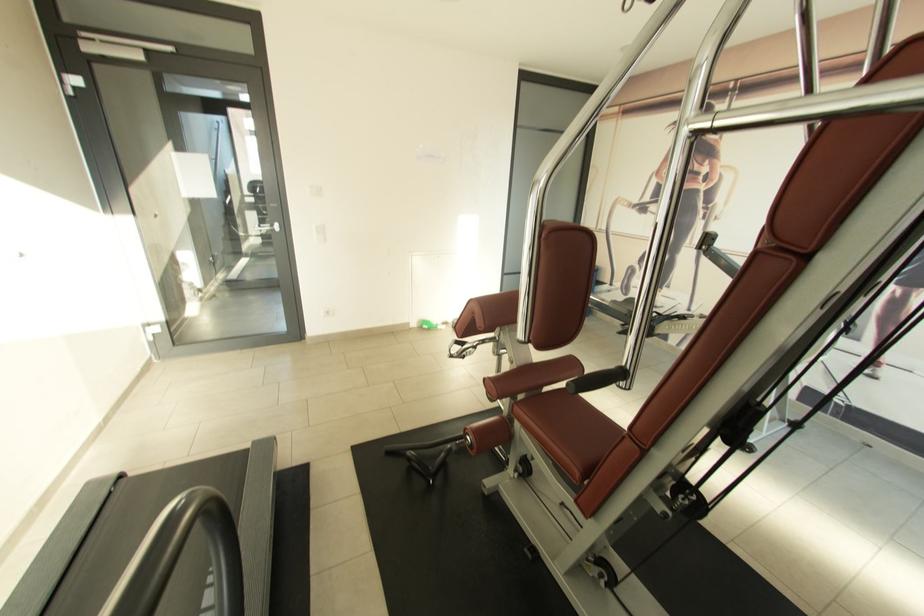
Where is `silver door handle`? Image resolution: width=924 pixels, height=616 pixels. silver door handle is located at coordinates (266, 228).